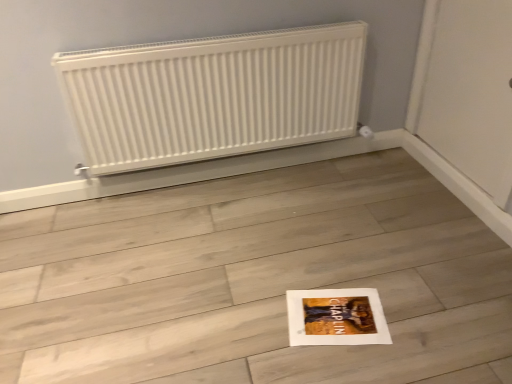
Question: Is white matte radiator at upper center outside white paper at center?

Choices:
 (A) yes
 (B) no

Answer: (A)

Question: From the image's perspective, does white matte radiator at upper center appear lower than white paper at center?

Choices:
 (A) no
 (B) yes

Answer: (A)

Question: Is white paper at center at the back of white matte radiator at upper center?

Choices:
 (A) no
 (B) yes

Answer: (A)

Question: Does white matte radiator at upper center come in front of white paper at center?

Choices:
 (A) no
 (B) yes

Answer: (A)

Question: Is white matte radiator at upper center bigger than white paper at center?

Choices:
 (A) yes
 (B) no

Answer: (B)

Question: Does white matte radiator at upper center have a smaller size compared to white paper at center?

Choices:
 (A) yes
 (B) no

Answer: (A)

Question: Does white paper at center lie in front of white matte radiator at upper center?

Choices:
 (A) yes
 (B) no

Answer: (A)

Question: Is white paper at center directly adjacent to white matte radiator at upper center?

Choices:
 (A) yes
 (B) no

Answer: (B)

Question: From a real-world perspective, is white paper at center located beneath white matte radiator at upper center?

Choices:
 (A) no
 (B) yes

Answer: (B)

Question: Is white paper at center bigger than white matte radiator at upper center?

Choices:
 (A) no
 (B) yes

Answer: (B)

Question: Considering the relative sizes of white paper at center and white matte radiator at upper center in the image provided, is white paper at center thinner than white matte radiator at upper center?

Choices:
 (A) no
 (B) yes

Answer: (A)

Question: Does white paper at center appear on the right side of white matte radiator at upper center?

Choices:
 (A) yes
 (B) no

Answer: (A)

Question: Relative to white paper at center, is white matte radiator at upper center in front or behind?

Choices:
 (A) behind
 (B) front

Answer: (A)